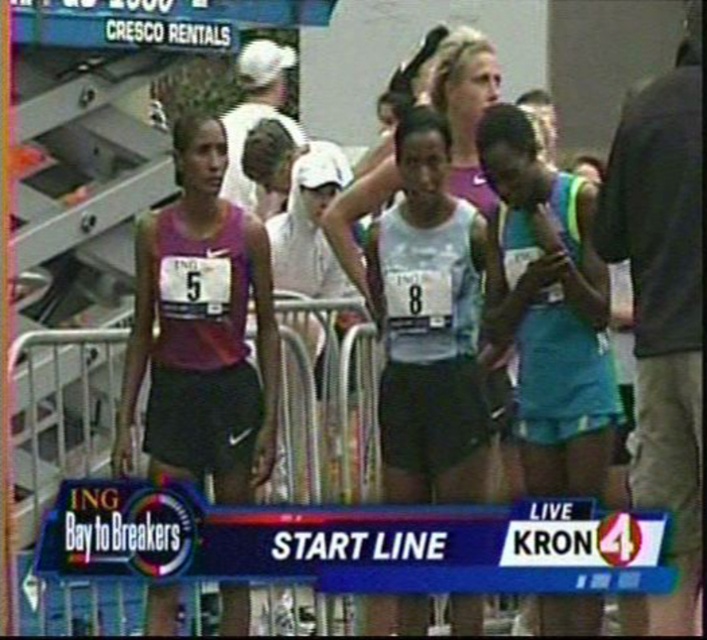
Question: Which point is farther to the camera?

Choices:
 (A) white plastic banner at center
 (B) teal fabric tank top at center

Answer: (B)

Question: Which of the following is the farthest from the observer?

Choices:
 (A) teal fabric tank top at center
 (B) white matte tank top at center
 (C) white plastic banner at center
 (D) matte purple tank top at left

Answer: (B)

Question: Is teal fabric tank top at center thinner than white matte tank top at center?

Choices:
 (A) yes
 (B) no

Answer: (A)

Question: Can you confirm if white plastic banner at center is bigger than matte purple tank top at left?

Choices:
 (A) yes
 (B) no

Answer: (B)

Question: Can you confirm if white plastic banner at center is wider than white matte tank top at center?

Choices:
 (A) yes
 (B) no

Answer: (A)

Question: Which object appears farthest from the camera in this image?

Choices:
 (A) white plastic banner at center
 (B) white matte tank top at center
 (C) teal fabric tank top at center

Answer: (B)